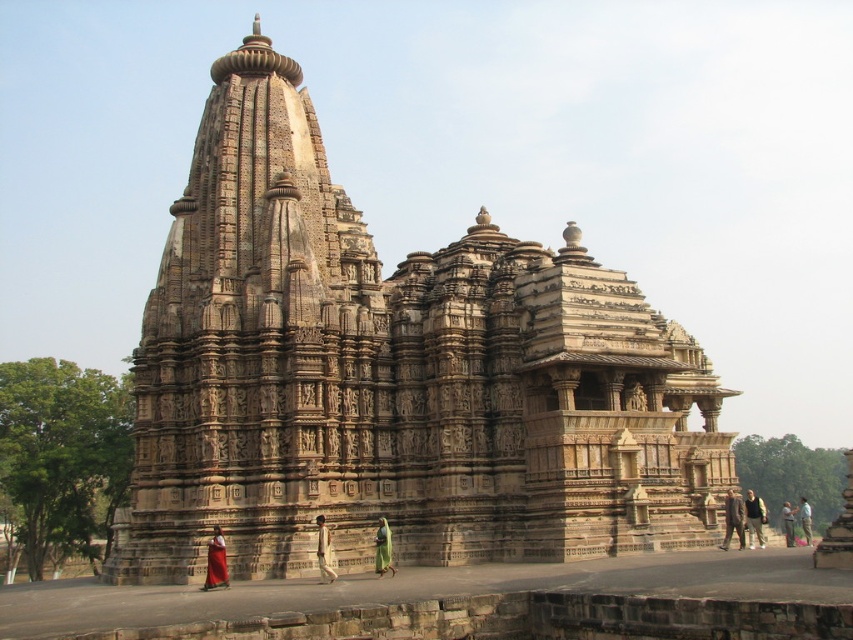
You are standing in front of the grand stone temple and notice a dark brown suit at center. Where exactly is the dark brown suit positioned in relation to the temple structure?

The dark brown suit at center is located at point coordinates approximately 0.812 along the horizontal axis and 0.860 along the vertical axis relative to the temple structure.